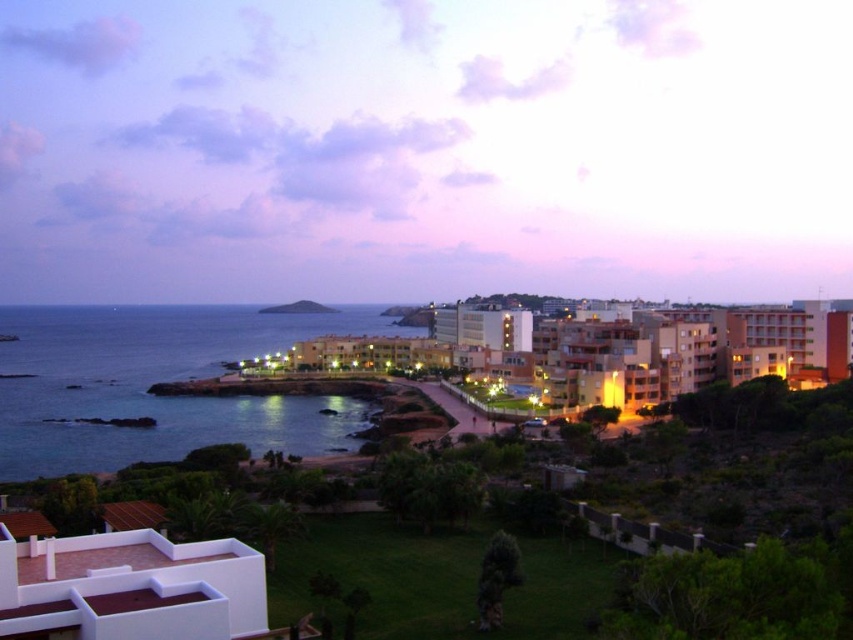
You are standing on a path that leads to the orange brick hotel at center. As you walk towards it, will the blue water at lower left become more visible or less visible in your view?

The blue water at lower left is closer to the viewer than the orange brick hotel at center. As you walk towards the hotel, the blue water at lower left will become less visible because it is behind the hotel.

You are standing at the edge of the grassy area looking towards the white matte roof at lower left and the green grassy hillside at center. Which object is nearer to you?

The white matte roof at lower left is closer to the viewer than the green grassy hillside at center.

You are standing on the grassy area in the foreground of the coastal scene. You see the blue water at lower left and the white matte roof at lower left. Which object is higher from the ground?

The blue water at lower left is higher from the ground than the white matte roof at lower left because it is positioned above it.